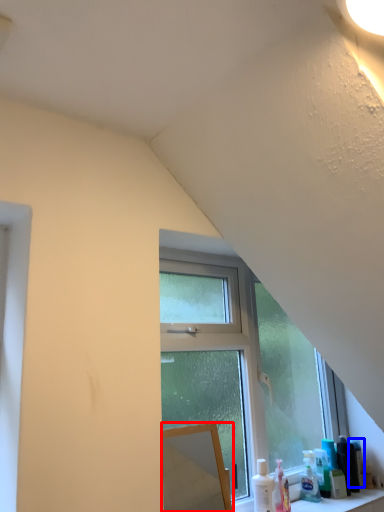
Question: Which of the following is the farthest to the observer, mirror (highlighted by a red box) or toiletry (highlighted by a blue box)?

Choices:
 (A) mirror
 (B) toiletry

Answer: (B)